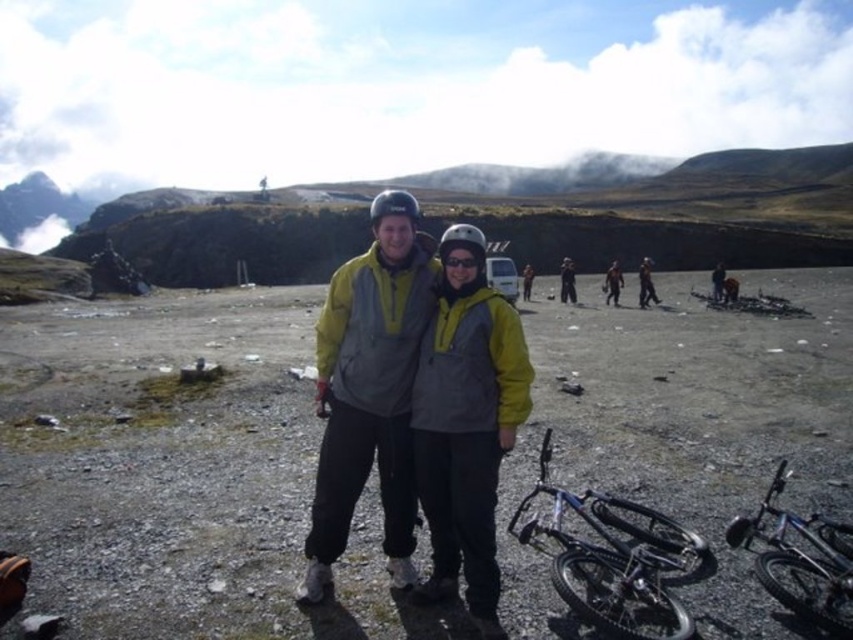
You are a hiker who wants to reach the yellow matte jacket at center. Which direction should you move from your current position at point (466, 426)?

The yellow matte jacket at center is located at point (466, 426), so you are already at the correct position.